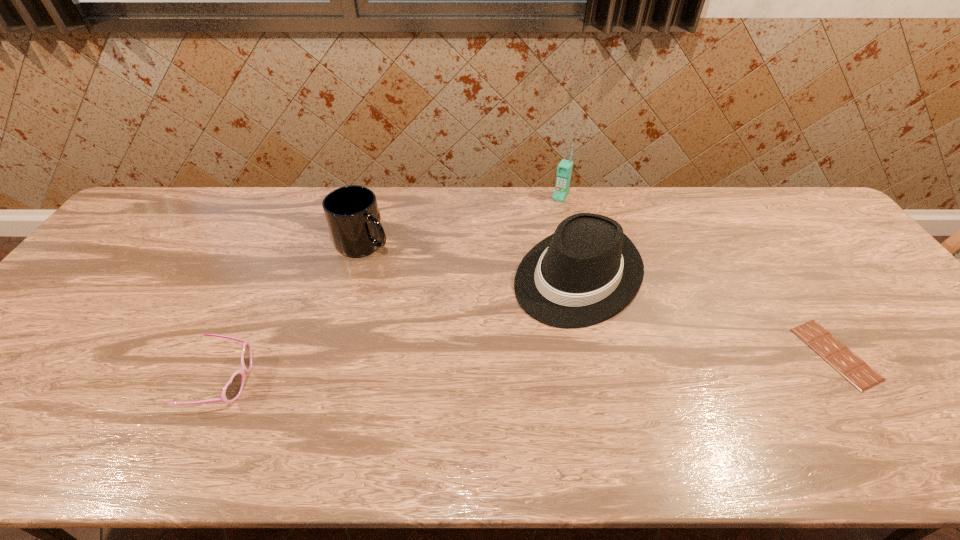
The image size is (960, 540). I want to click on vacant space situated on the front-facing side of the fedora, so click(510, 342).

Where is `free region located on the front-facing side of the fedora`? free region located on the front-facing side of the fedora is located at coordinates (502, 349).

Identify the location of free space located on the front-facing side of the fedora. (491, 359).

Where is `free space located on the keypad of the cellular telephone`? The width and height of the screenshot is (960, 540). free space located on the keypad of the cellular telephone is located at coordinates (546, 219).

At what (x,y) coordinates should I click in order to perform the action: click on free spot located on the keypad of the cellular telephone. Please return your answer as a coordinate pair (x, y). The width and height of the screenshot is (960, 540). Looking at the image, I should click on click(532, 241).

Where is `free space located 0.150m on the keypad of the cellular telephone`? This screenshot has height=540, width=960. free space located 0.150m on the keypad of the cellular telephone is located at coordinates 540,228.

At what (x,y) coordinates should I click in order to perform the action: click on vacant area located 0.130m with the handle on the side of the second object from left to right. Please return your answer as a coordinate pair (x, y). The image size is (960, 540). Looking at the image, I should click on click(x=403, y=280).

Identify the location of vacant area situated with the handle on the side of the second object from left to right. This screenshot has width=960, height=540. (403, 280).

In order to click on blank space located 0.280m with the handle on the side of the second object from left to right in this screenshot , I will do `click(435, 312)`.

This screenshot has width=960, height=540. Find the location of `fedora that is at the far edge`. fedora that is at the far edge is located at coordinates (588, 270).